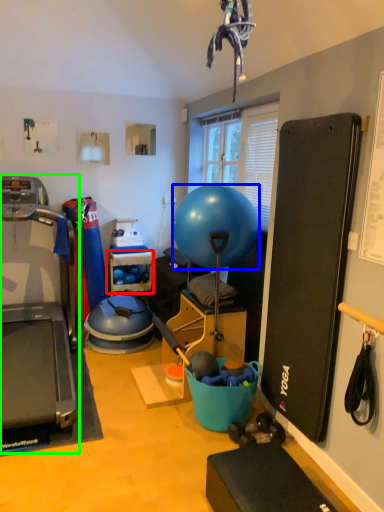
Question: Which object is positioned farthest from shelf (highlighted by a red box)? Select from ball (highlighted by a blue box) and treadmill (highlighted by a green box).

Choices:
 (A) ball
 (B) treadmill

Answer: (A)